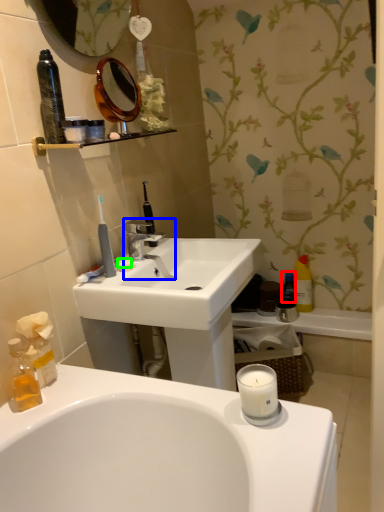
Question: Which is nearer to the mouthwash (highlighted by a red box)? tap (highlighted by a blue box) or soap (highlighted by a green box).

Choices:
 (A) tap
 (B) soap

Answer: (A)